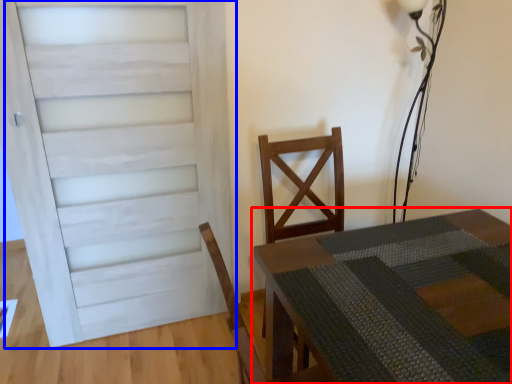
Question: Among these objects, which one is nearest to the camera, table (highlighted by a red box) or door (highlighted by a blue box)?

Choices:
 (A) table
 (B) door

Answer: (A)